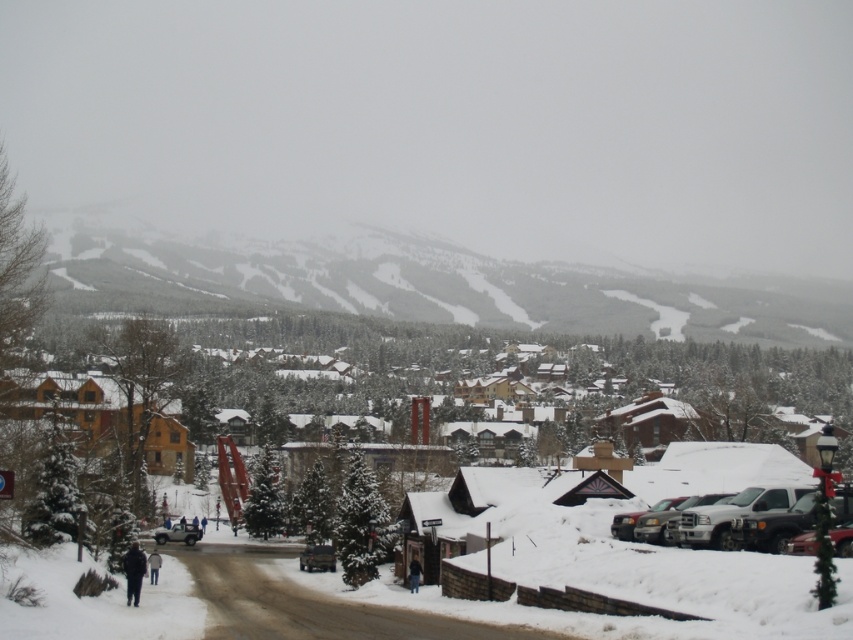
Consider the image. Does metallic silver truck at lower right appear under metallic silver car at center?

Incorrect, metallic silver truck at lower right is not positioned below metallic silver car at center.

Is point (641, 538) farther from camera compared to point (323, 561)?

No, it is in front of (323, 561).

At what (x,y) coordinates should I click in order to perform the action: click on metallic silver truck at lower right. Please return your answer as a coordinate pair (x, y). This screenshot has width=853, height=640. Looking at the image, I should click on (764, 522).

Does point (764, 497) come farther from viewer compared to point (178, 532)?

No, (764, 497) is closer to viewer.

Locate an element on the screen. This screenshot has height=640, width=853. metallic silver truck at lower right is located at coordinates (764, 522).

Which is behind, point (312, 560) or point (171, 534)?

The point (171, 534) is behind.

Can you confirm if metallic silver car at center is positioned to the left of silver metallic suv at center?

Incorrect, metallic silver car at center is not on the left side of silver metallic suv at center.

Who is more distant from viewer, (334,556) or (183,540)?

The point (183,540) is behind.

Where is `metallic silver car at center`? The width and height of the screenshot is (853, 640). metallic silver car at center is located at coordinates (317, 557).